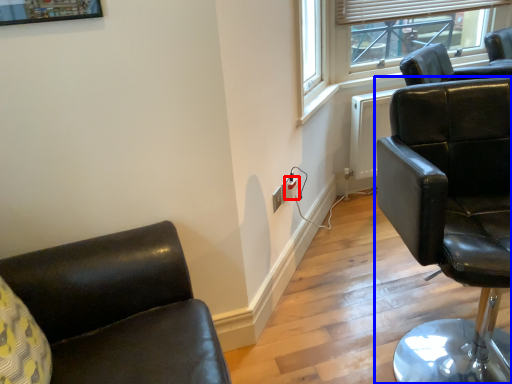
Question: Which object appears farthest to the camera in this image, electric outlet (highlighted by a red box) or chair (highlighted by a blue box)?

Choices:
 (A) electric outlet
 (B) chair

Answer: (A)